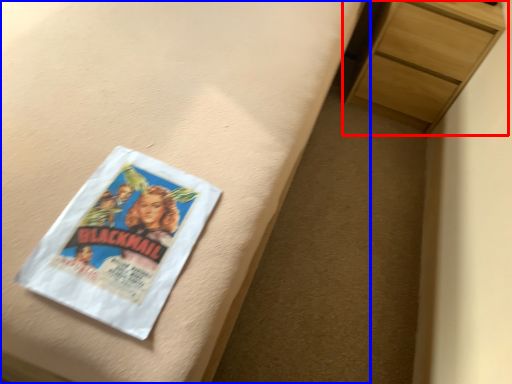
Question: Which object appears closest to the camera in this image, chest of drawers (highlighted by a red box) or bed frame (highlighted by a blue box)?

Choices:
 (A) chest of drawers
 (B) bed frame

Answer: (B)